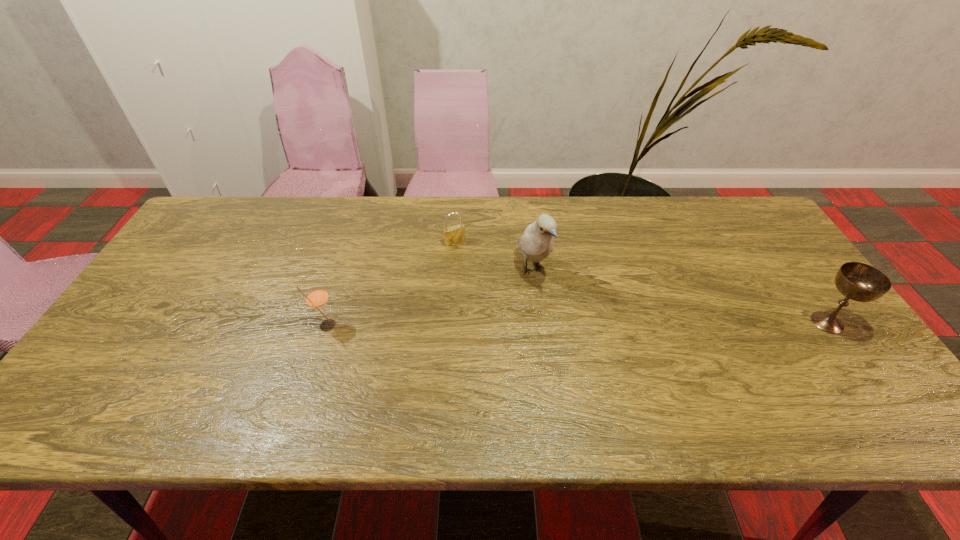
The height and width of the screenshot is (540, 960). Identify the location of vacant space on the desktop that is between the leftmost object and the chalice and is positioned on the front-facing side of the padlock. (512, 324).

Where is `free spot on the desktop that is between the leftmost object and the rightmost object and is positioned at the beak of the tallest object`? Image resolution: width=960 pixels, height=540 pixels. free spot on the desktop that is between the leftmost object and the rightmost object and is positioned at the beak of the tallest object is located at coordinates pyautogui.click(x=568, y=324).